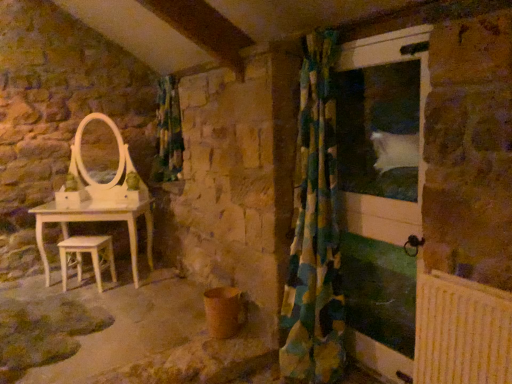
Question: From the image's perspective, would you say white glossy screen door at right is shown under green and blue checkered fabric at center?

Choices:
 (A) no
 (B) yes

Answer: (B)

Question: Considering the relative sizes of white glossy screen door at right and green and blue checkered fabric at center in the image provided, is white glossy screen door at right wider than green and blue checkered fabric at center?

Choices:
 (A) yes
 (B) no

Answer: (B)

Question: Is white glossy screen door at right far away from green and blue checkered fabric at center?

Choices:
 (A) no
 (B) yes

Answer: (B)

Question: Can you see white glossy screen door at right touching green and blue checkered fabric at center?

Choices:
 (A) no
 (B) yes

Answer: (A)

Question: Is white glossy screen door at right located outside green and blue checkered fabric at center?

Choices:
 (A) yes
 (B) no

Answer: (A)

Question: Do you think light wood stool at lower left is within green and blue checkered fabric at center, or outside of it?

Choices:
 (A) inside
 (B) outside

Answer: (B)

Question: Is light wood stool at lower left taller or shorter than green and blue checkered fabric at center?

Choices:
 (A) tall
 (B) short

Answer: (B)

Question: In terms of width, does light wood stool at lower left look wider or thinner when compared to green and blue checkered fabric at center?

Choices:
 (A) thin
 (B) wide

Answer: (A)

Question: From a real-world perspective, relative to green and blue checkered fabric at center, is light wood stool at lower left vertically above or below?

Choices:
 (A) below
 (B) above

Answer: (A)

Question: Relative to white glossy screen door at right, is green and blue checkered fabric at center in front or behind?

Choices:
 (A) behind
 (B) front

Answer: (A)

Question: Is point (170, 122) closer or farther from the camera than point (420, 97)?

Choices:
 (A) closer
 (B) farther

Answer: (B)

Question: Is green and blue checkered fabric at center spatially inside white glossy screen door at right, or outside of it?

Choices:
 (A) inside
 (B) outside

Answer: (B)

Question: From a real-world perspective, is green and blue checkered fabric at center above or below white glossy screen door at right?

Choices:
 (A) below
 (B) above

Answer: (B)

Question: Do you think green-yellow checkered curtain at right is within white glossy screen door at right, or outside of it?

Choices:
 (A) inside
 (B) outside

Answer: (B)

Question: Considering the relative positions of green-yellow checkered curtain at right and white glossy screen door at right in the image provided, is green-yellow checkered curtain at right to the left or to the right of white glossy screen door at right?

Choices:
 (A) right
 (B) left

Answer: (B)